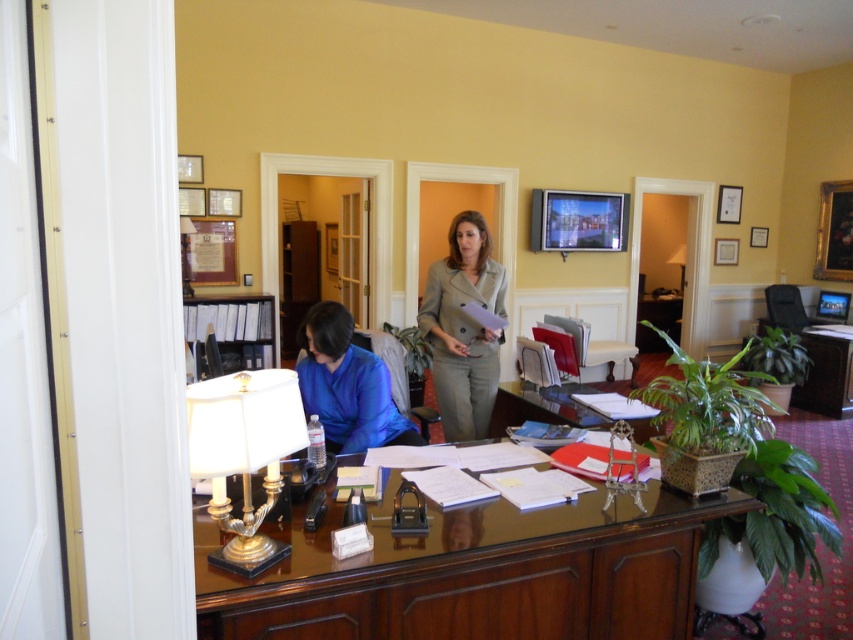
In the office scene described, there is a light gray suit at center and a matte white lamp at upper right. Which object is taller?

The light gray suit at center is much taller than the matte white lamp at upper right.

Please look at the image and identify what object or person is located at the coordinates point (463, 326). The scene has a desk with office supplies and a potted plant. Your options are the light gray suit at center or the potted plant at right side.

The point (463, 326) marks the light gray suit at center.